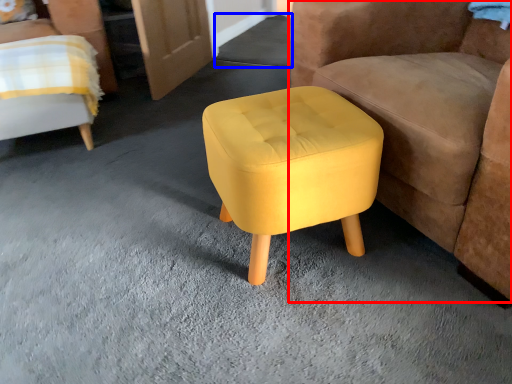
Question: Which point is further to the camera, chair (highlighted by a red box) or concrete (highlighted by a blue box)?

Choices:
 (A) chair
 (B) concrete

Answer: (B)